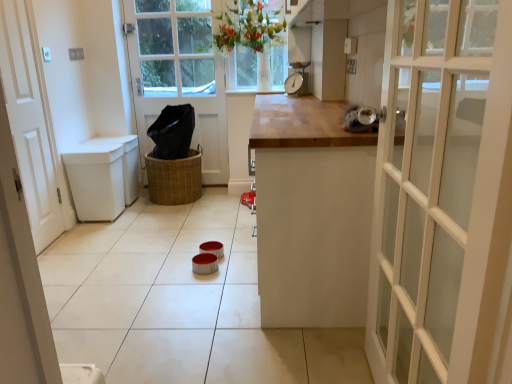
Question: Is braided wicker basket at center at the left side of white matte door at left, the 2th door in the back-to-front sequence?

Choices:
 (A) no
 (B) yes

Answer: (A)

Question: Would you say braided wicker basket at center is outside white matte door at left, the second door from the right?

Choices:
 (A) yes
 (B) no

Answer: (A)

Question: Is braided wicker basket at center directly adjacent to white matte door at left, which appears as the first door when viewed from the front?

Choices:
 (A) no
 (B) yes

Answer: (A)

Question: From a real-world perspective, is braided wicker basket at center under white matte door at left, the second door from the right?

Choices:
 (A) no
 (B) yes

Answer: (B)

Question: Can you confirm if braided wicker basket at center is bigger than white matte door at left, which appears as the first door when viewed from the front?

Choices:
 (A) yes
 (B) no

Answer: (A)

Question: From a real-world perspective, relative to metallic scale at center, is white wooden door at center, the 2th door positioned from the front, vertically above or below?

Choices:
 (A) above
 (B) below

Answer: (B)

Question: Looking at their shapes, would you say white wooden door at center, which ranks as the 1th door in back-to-front order, is wider or thinner than metallic scale at center?

Choices:
 (A) wide
 (B) thin

Answer: (B)

Question: From their relative heights in the image, would you say white wooden door at center, arranged as the second door when viewed from the left, is taller or shorter than metallic scale at center?

Choices:
 (A) tall
 (B) short

Answer: (A)

Question: Considering the positions of point (200, 92) and point (285, 87), is point (200, 92) closer or farther from the camera than point (285, 87)?

Choices:
 (A) farther
 (B) closer

Answer: (A)

Question: From a real-world perspective, relative to white matte door at left, arranged as the first door when viewed from the left, is white wooden door at center, arranged as the second door when viewed from the left, vertically above or below?

Choices:
 (A) above
 (B) below

Answer: (A)

Question: Is point (221, 91) closer or farther from the camera than point (6, 76)?

Choices:
 (A) closer
 (B) farther

Answer: (B)

Question: From the image's perspective, is white wooden door at center, arranged as the second door when viewed from the left, positioned above or below white matte door at left, the second door from the right?

Choices:
 (A) below
 (B) above

Answer: (B)

Question: Considering the positions of white wooden door at center, which ranks as the 1th door in back-to-front order, and white matte door at left, the second door from the right, in the image, is white wooden door at center, which ranks as the 1th door in back-to-front order, wider or thinner than white matte door at left, the second door from the right,?

Choices:
 (A) wide
 (B) thin

Answer: (A)

Question: Based on their positions, is white matte door at left, which appears as the first door when viewed from the front, located to the left or right of braided wicker basket at center?

Choices:
 (A) left
 (B) right

Answer: (A)

Question: From a real-world perspective, is white matte door at left, the 2th door in the back-to-front sequence, physically located above or below braided wicker basket at center?

Choices:
 (A) below
 (B) above

Answer: (B)